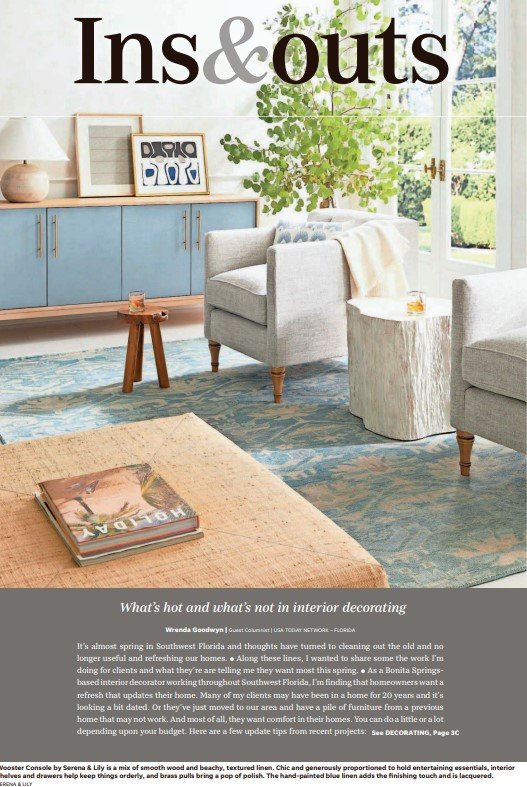
Locate an element on the screen. The image size is (527, 787). lamps is located at coordinates (26, 175).